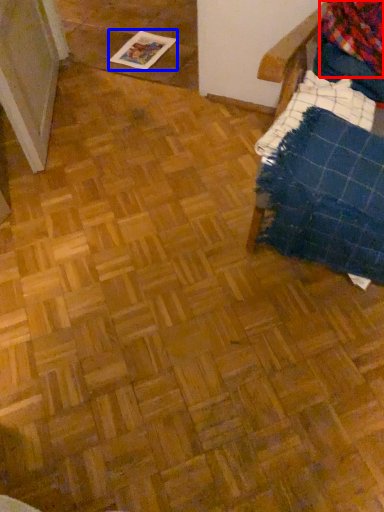
Question: Which object appears closest to the camera in this image, flannel (highlighted by a red box) or magazine (highlighted by a blue box)?

Choices:
 (A) flannel
 (B) magazine

Answer: (A)